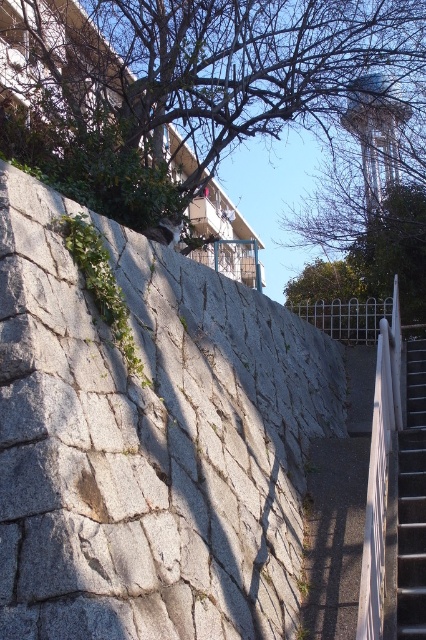
Question: Does gray granite wall at center have a greater width compared to metallic gray stair at lower right?

Choices:
 (A) yes
 (B) no

Answer: (B)

Question: Which object is closer to the camera taking this photo?

Choices:
 (A) gray granite wall at center
 (B) green leafy tree at upper center

Answer: (A)

Question: Is gray granite wall at center wider than green leafy tree at upper center?

Choices:
 (A) no
 (B) yes

Answer: (A)

Question: Which object appears farthest from the camera in this image?

Choices:
 (A) metallic gray stair at lower right
 (B) green leafy tree at upper center

Answer: (B)

Question: Does green leafy tree at upper center appear under metallic gray stair at lower right?

Choices:
 (A) yes
 (B) no

Answer: (B)

Question: Which point appears farthest from the camera in this image?

Choices:
 (A) (420, 483)
 (B) (161, 621)
 (C) (354, 20)

Answer: (C)